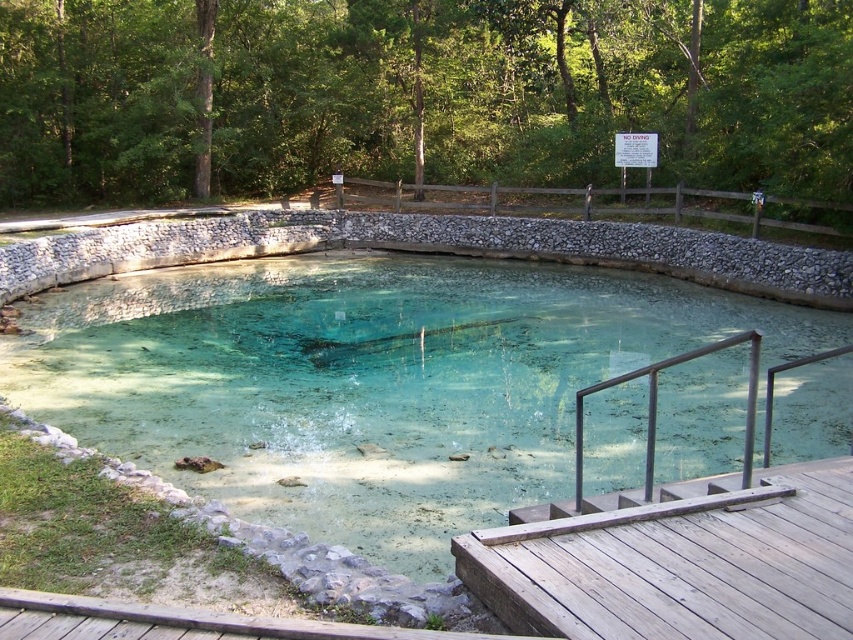
Question: Can you confirm if clear stone pond at center is wider than brown wooden rail at upper center?

Choices:
 (A) yes
 (B) no

Answer: (A)

Question: From the image, what is the correct spatial relationship of clear stone pond at center in relation to brown wooden rail at upper center?

Choices:
 (A) above
 (B) below

Answer: (B)

Question: Is clear stone pond at center bigger than brown wooden rail at upper center?

Choices:
 (A) no
 (B) yes

Answer: (A)

Question: Which object appears farthest from the camera in this image?

Choices:
 (A) clear stone pond at center
 (B) brown wooden rail at upper center

Answer: (B)

Question: Which point is closer to the camera?

Choices:
 (A) clear stone pond at center
 (B) brown wooden rail at upper center

Answer: (A)